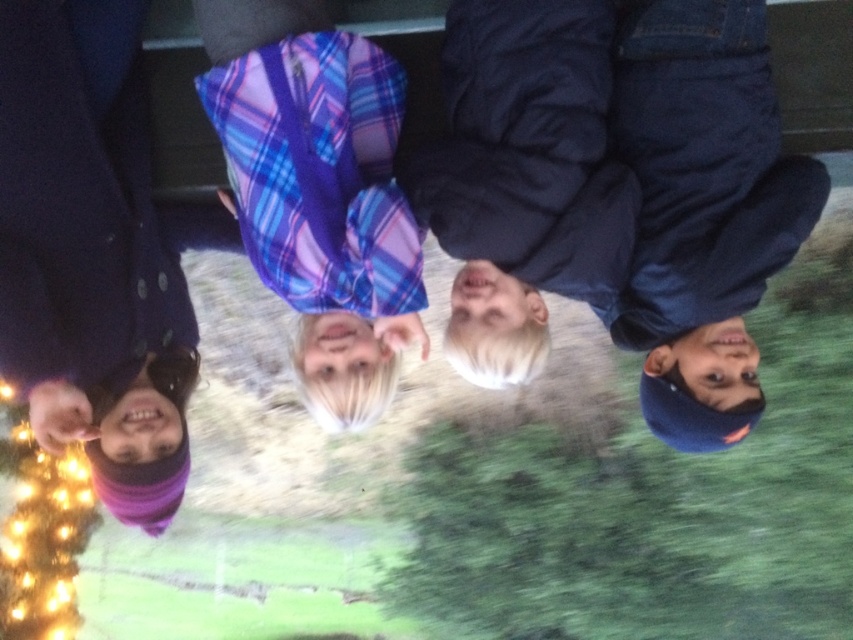
Between point (503, 116) and point (277, 147), which one is positioned in front?

Point (277, 147)

Which is above, dark blue puffy jacket at center or plaid fabric shirt at center?

Positioned higher is dark blue puffy jacket at center.

Is point (659, 221) positioned after point (323, 113)?

Yes, it is.

Locate an element on the screen. This screenshot has width=853, height=640. dark blue puffy jacket at center is located at coordinates (625, 180).

Does dark blue puffy jacket at center have a greater width compared to purple woolen hat at lower left?

Correct, the width of dark blue puffy jacket at center exceeds that of purple woolen hat at lower left.

Can you confirm if dark blue puffy jacket at center is shorter than purple woolen hat at lower left?

A: Indeed, dark blue puffy jacket at center has a lesser height compared to purple woolen hat at lower left.

Between point (647, 90) and point (177, 300), which one is positioned in front?

Point (647, 90) is more forward.

Locate an element on the screen. This screenshot has height=640, width=853. dark blue puffy jacket at center is located at coordinates (625, 180).

Is purple woolen hat at lower left below plaid fabric shirt at center?

Yes.

Who is more forward, (135, 444) or (328, 83)?

Point (328, 83) is more forward.

At what (x,y) coordinates should I click in order to perform the action: click on purple woolen hat at lower left. Please return your answer as a coordinate pair (x, y). This screenshot has width=853, height=640. Looking at the image, I should click on (90, 253).